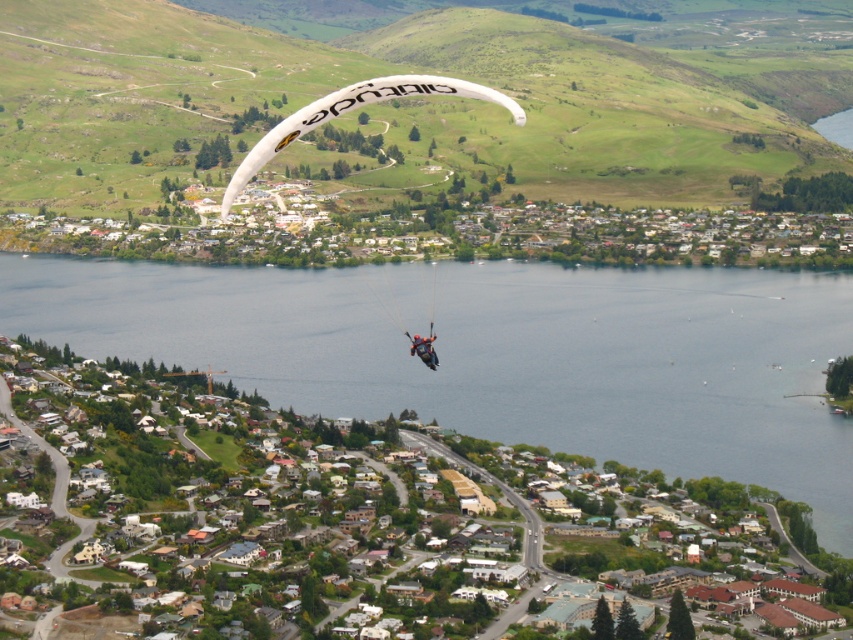
Question: Is white matte parachute at center smaller than dark blue fabric parachute at center?

Choices:
 (A) yes
 (B) no

Answer: (B)

Question: Which of the following is the closest to the observer?

Choices:
 (A) (637, 164)
 (B) (229, 198)
 (C) (764, 365)
 (D) (416, 353)

Answer: (D)

Question: Does white matte parachute at center have a smaller size compared to dark blue fabric parachute at center?

Choices:
 (A) no
 (B) yes

Answer: (A)

Question: Among these points, which one is farthest from the camera?

Choices:
 (A) (416, 90)
 (B) (425, 337)

Answer: (A)

Question: Among these points, which one is farthest from the camera?

Choices:
 (A) (160, 312)
 (B) (428, 356)
 (C) (120, 64)

Answer: (C)

Question: Does white fabric parachute at center appear on the right side of white matte parachute at center?

Choices:
 (A) no
 (B) yes

Answer: (B)